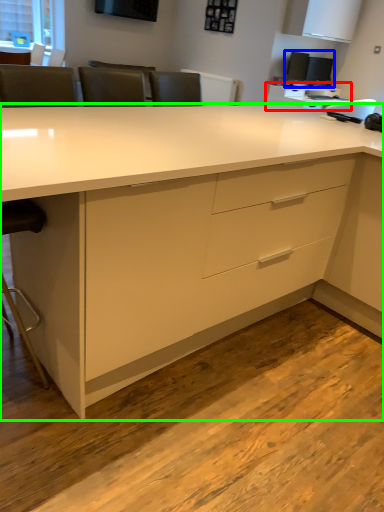
Question: Considering the real-world distances, which object is closest to computer desk (highlighted by a red box)? desktop computer (highlighted by a blue box) or desk (highlighted by a green box).

Choices:
 (A) desktop computer
 (B) desk

Answer: (A)